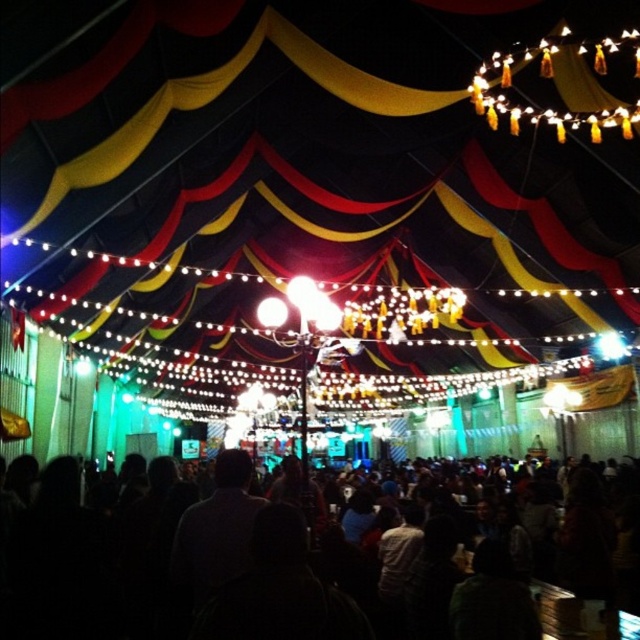
You are standing inside the tent and want to move from the point at coordinates point (128, 301) to the point at coordinates point (246, 468). Will you have to walk towards or away from the crowd in the background?

Since point (128, 301) is further to the viewer than point (246, 468), moving from point (128, 301) to point (246, 468) requires walking away from the crowd in the background.

You are standing inside the carnival tent and want to locate the yellow fabric canopy at upper center. Which direction should you look relative to the black matte crowd at center?

The yellow fabric canopy at upper center is to the left of the black matte crowd at center, so you should look to the left side of the black matte crowd at center to find it.